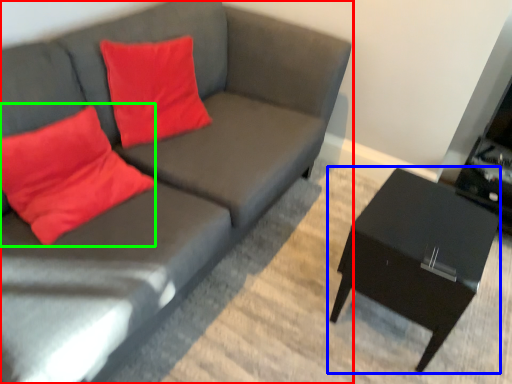
Question: Which object is positioned farthest from studio couch (highlighted by a red box)? Select from table (highlighted by a blue box) and throw pillow (highlighted by a green box).

Choices:
 (A) table
 (B) throw pillow

Answer: (A)